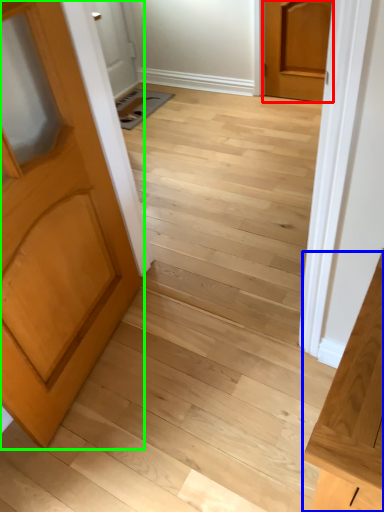
Question: Which object is positioned farthest from door (highlighted by a red box)? Select from vanity (highlighted by a blue box) and door (highlighted by a green box).

Choices:
 (A) vanity
 (B) door

Answer: (A)